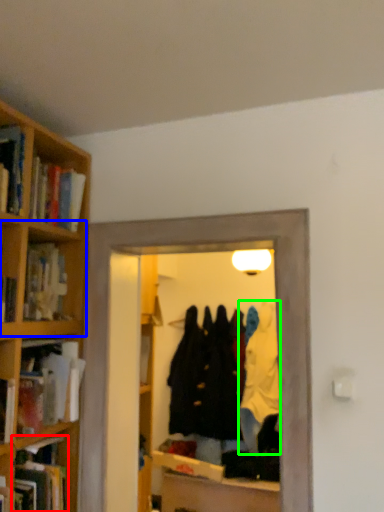
Question: Which is nearer to the book (highlighted by a red box)? cabinet (highlighted by a blue box) or clothing (highlighted by a green box).

Choices:
 (A) cabinet
 (B) clothing

Answer: (A)